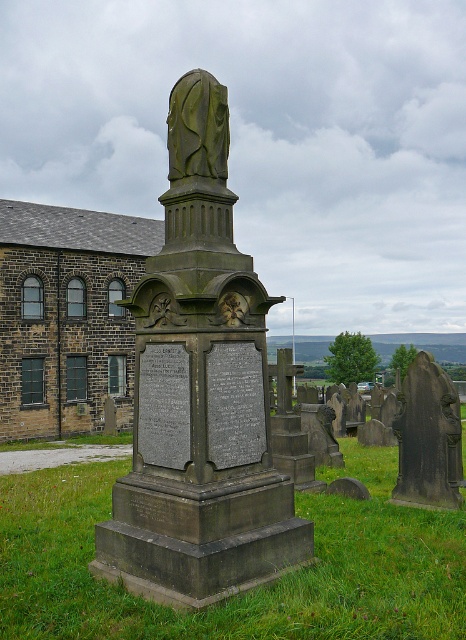
You are standing at the camera position and want to place a new flower bouquet exactly 15 feet away from the dark gray stone monument at center. Is the bouquet placed in front of or behind the monument relative to your position?

The dark gray stone monument at center is 14.38 feet away from camera. If you place the bouquet 15 feet away from the monument, it would be 14.38 feet plus 15 feet equals 29.38 feet from the camera. Since the monument is between you and the bouquet, the bouquet is placed behind the monument relative to your position.

You are a gardener trying to mow the lawn. You see the dark gray stone monument at center and the green grass at center. Which one can you safely mow?

The green grass at center can be safely mowed since the dark gray stone monument at center is thinner than it, indicating the grass is wider and part of the lawn.

You are a groundskeeper with a lawnmower that has a 1.5 meter cutting width. You need to mow the green grass at center near the dark gray stone monument at center. Can your lawnmower fit between them without hitting the monument?

The distance between the dark gray stone monument at center and the green grass at center is 2.42 meters. Since your lawnmower requires only 1.5 meters of space, there is enough room to mow the grass without hitting the monument.